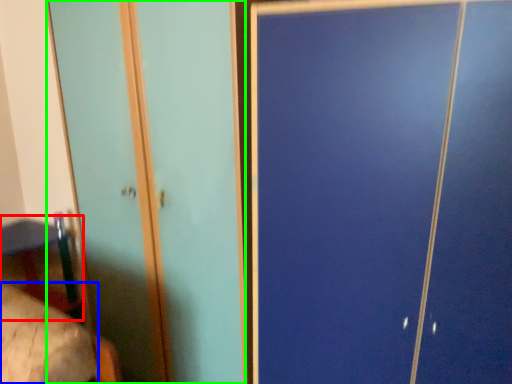
Question: Which object is positioned closest to table (highlighted by a red box)? Select from mattress (highlighted by a blue box) and screen door (highlighted by a green box).

Choices:
 (A) mattress
 (B) screen door

Answer: (B)